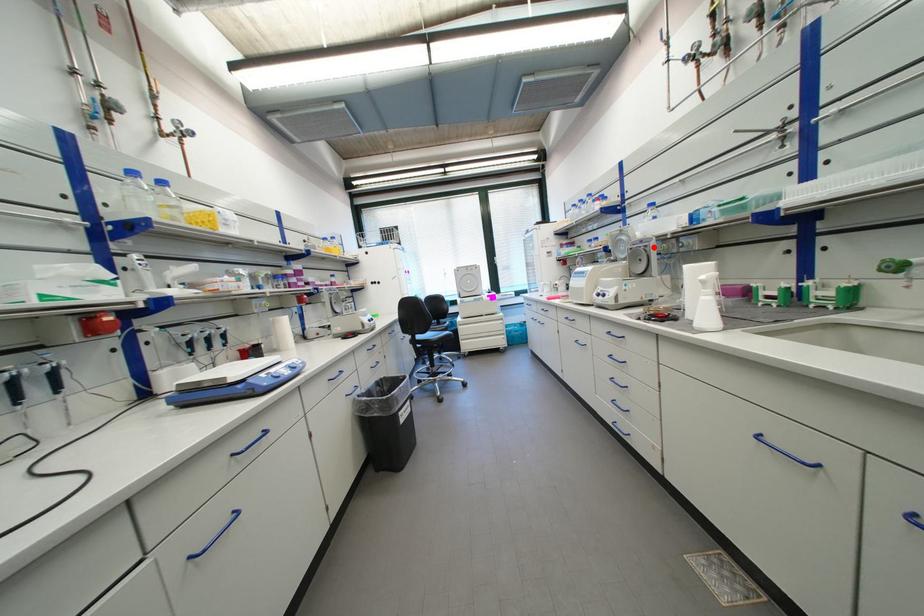
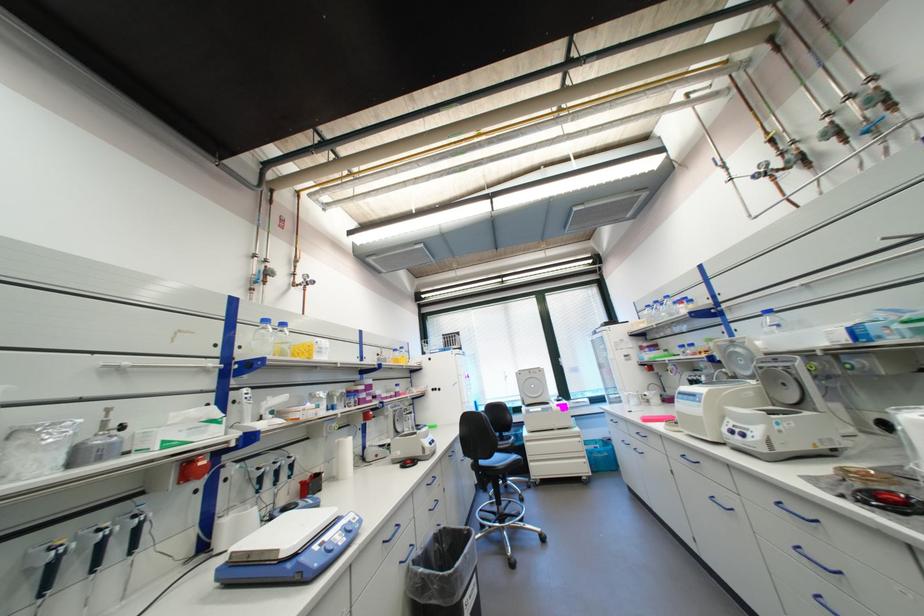
Locate, in the second image, the point that corresponds to the highlighted location in the first image.

(796, 369)